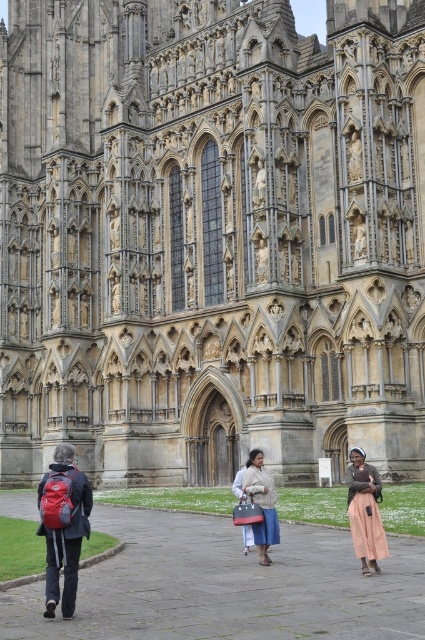
You are standing at the entrance of the cathedral and notice two items in the foreground. The red fabric backpack at lower left and the light brown fabric coat at center. Which item appears taller in the image?

The red fabric backpack at lower left appears taller than the light brown fabric coat at center in the image.

You are standing at the entrance of the cathedral and notice a light brown fabric coat at center. If you want to retrieve it, which direction should you move relative to the cathedral?

The light brown fabric coat at center is located at point (261, 502), so you should move towards the center area of the image to retrieve it.